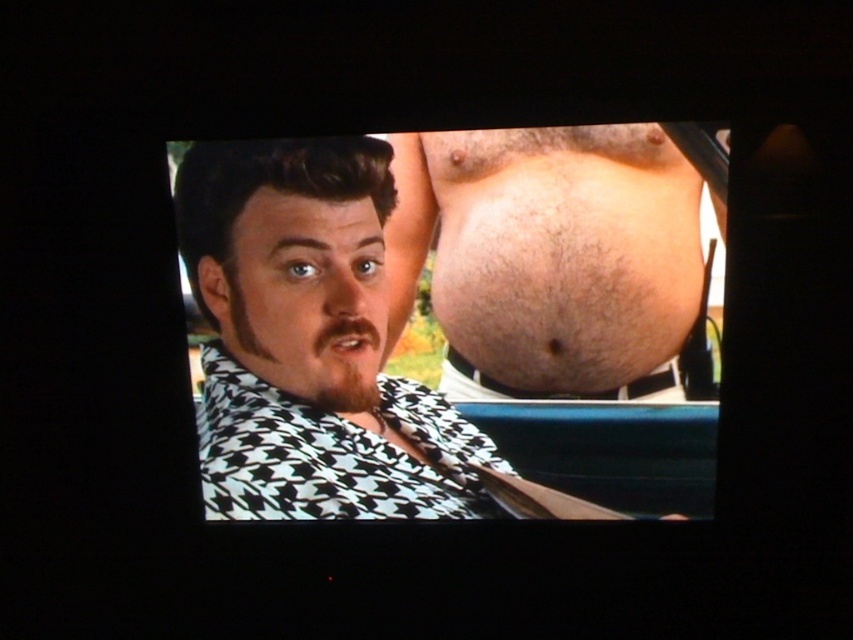
How far apart are hairy skin belly at center and black houndstooth scarf at center?

A distance of 8.42 inches exists between hairy skin belly at center and black houndstooth scarf at center.

Who is lower down, hairy skin belly at center or black houndstooth scarf at center?

black houndstooth scarf at center is below.

Is point (463, 301) closer to camera compared to point (358, 396)?

That is True.

Locate an element on the screen. The height and width of the screenshot is (640, 853). hairy skin belly at center is located at coordinates (549, 257).

Is black houndstooth shirt at center bigger than black houndstooth scarf at center?

Yes.

Which is more to the right, black houndstooth shirt at center or black houndstooth scarf at center?

black houndstooth shirt at center

Between point (318, 180) and point (248, 324), which one is positioned behind?

The point (248, 324) is more distant.

The image size is (853, 640). I want to click on black houndstooth shirt at center, so click(310, 342).

Does black houndstooth shirt at center have a lesser width compared to hairy skin belly at center?

No.

What do you see at coordinates (310, 342) in the screenshot?
I see `black houndstooth shirt at center` at bounding box center [310, 342].

Is point (271, 144) farther from camera compared to point (399, 278)?

That is False.

Identify the location of black houndstooth shirt at center. This screenshot has width=853, height=640. (310, 342).